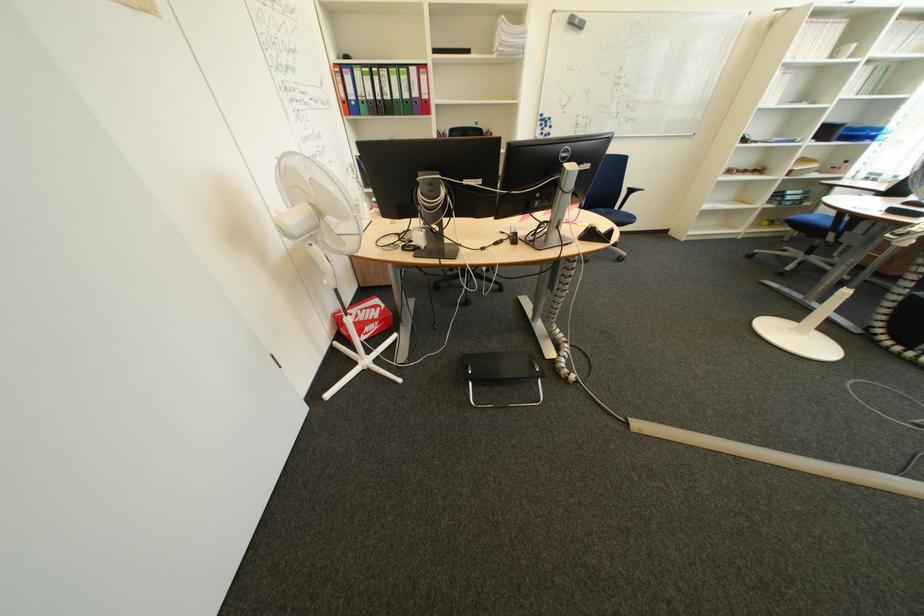
Where would you sit the chair sitting surface? Please return your answer as a coordinate pair (x, y).

(616, 216)